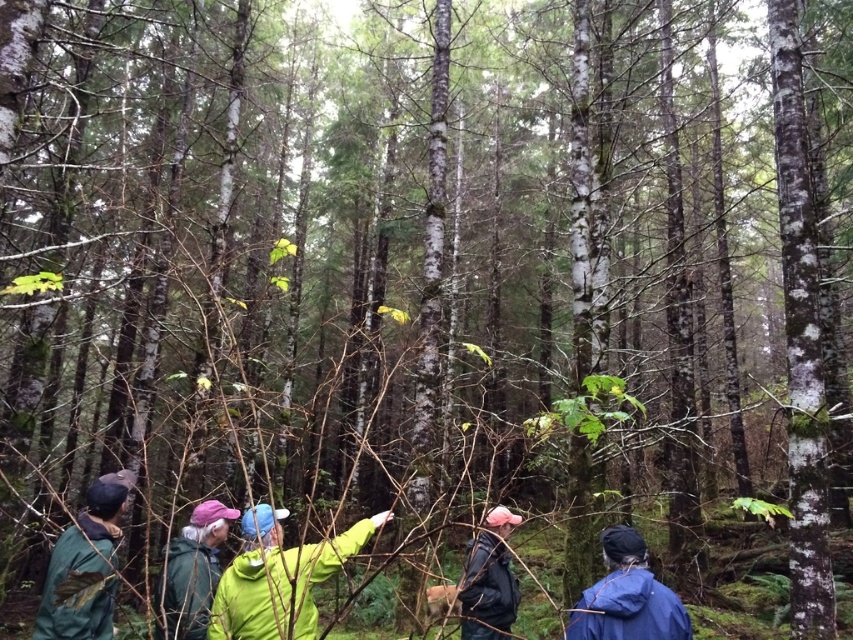
You are standing in the forest and see the green fabric jacket at lower center. If you want to approach it, how many steps would you need to take to reach it, assuming each step covers approximately 2 feet?

The green fabric jacket at lower center is 6.32 feet away from the viewer. Since each step covers about 2 feet, you would need approximately 3 steps to reach it.

You are a hiker trying to follow the group through the dense forest. You see two people wearing green matte jackets. Which jacket is closer to you, the green matte jacket at center or the green matte jacket at lower left?

The green matte jacket at center is closer to you because it is positioned over the green matte jacket at lower left, meaning it is in front spatially.